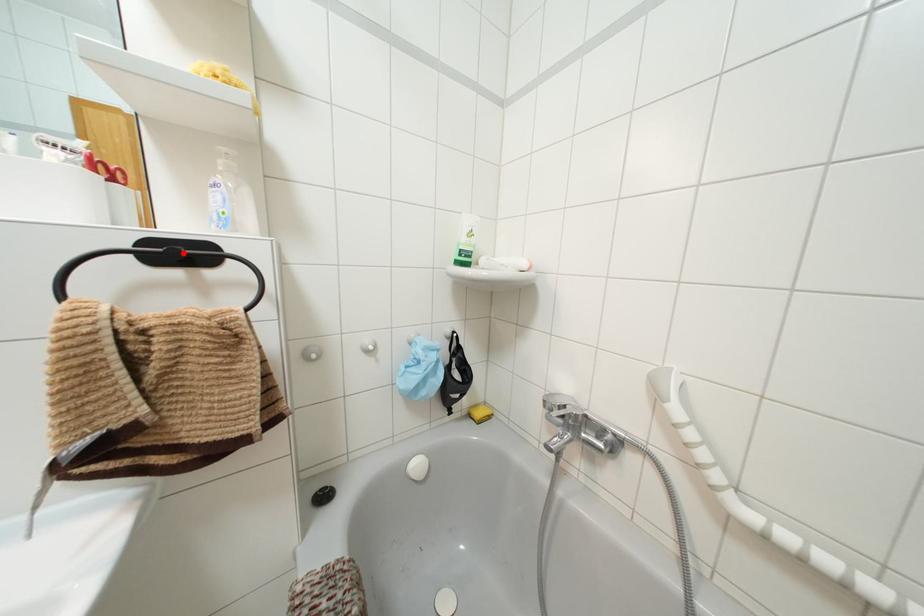
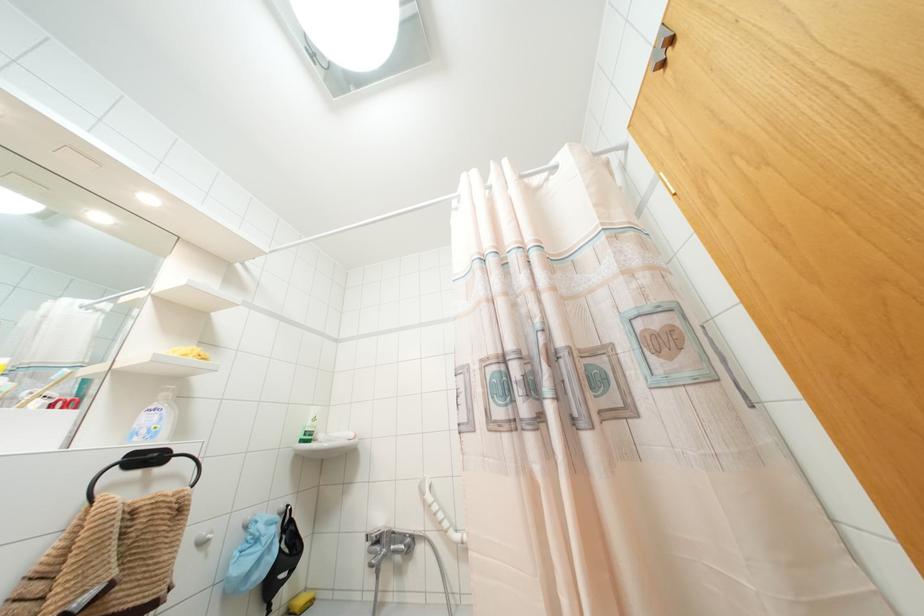
The point at the highlighted location is marked in the first image. Where is the corresponding point in the second image?

(147, 458)